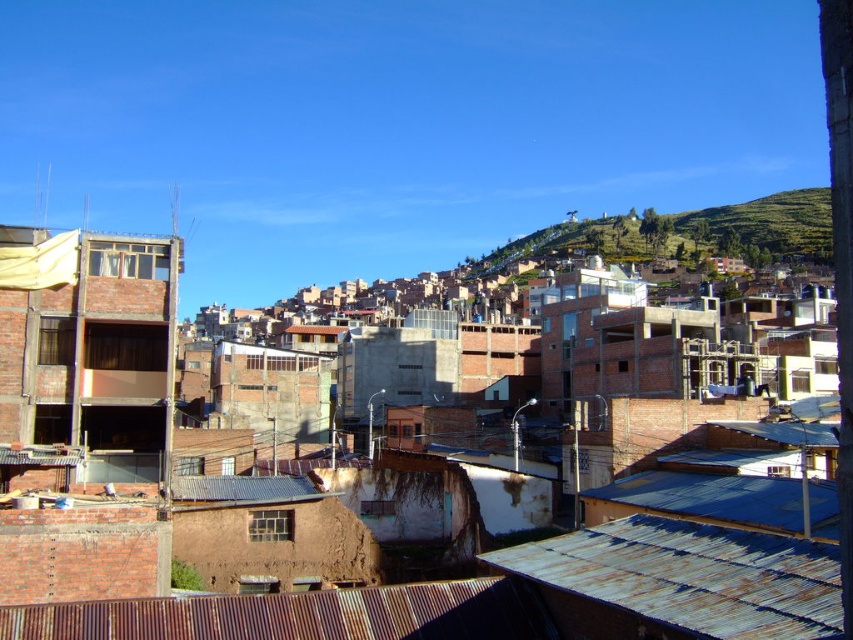
You are a delivery drone operator trying to navigate between two rusty corrugated metal roofs in a crowded urban area. The roofs are labeled as rusty corrugated metal roof at lower right and rusty corrugated metal roof at lower center. Given that your drone has a wingspan of 1.5 meters, can it safely pass through the space between them without collision?

The distance between the rusty corrugated metal roof at lower right and the rusty corrugated metal roof at lower center is 7.74 meters. Since the drone has a wingspan of 1.5 meters, it can safely navigate through the space between them as the available space is significantly larger than the drone.

You are a city planner assessing the urban layout. You notice the rusty corrugated metal roof at lower center and the green grassy hillside at upper center. Which of these two features occupies a smaller horizontal space in the image?

The rusty corrugated metal roof at lower center has a lesser width compared to the green grassy hillside at upper center, so it occupies a smaller horizontal space.

You are a delivery drone flying over the urban area. You need to navigate between the rusty corrugated metal roof at lower center and the green grassy hillside at upper center. Which direction should you turn to move from the roof to the hillside?

The rusty corrugated metal roof at lower center is to the left of the green grassy hillside at upper center, so you should turn to the right to move from the roof to the hillside.